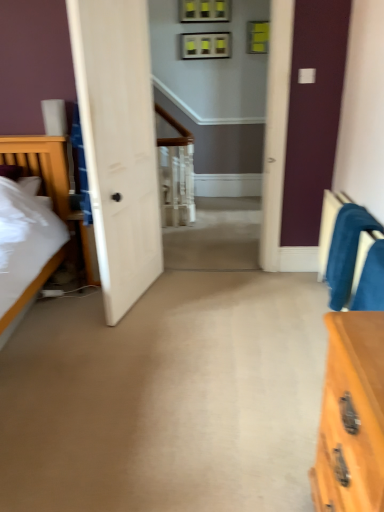
I want to click on vacant area on top of velvet blue armchair at right, the second armchair in the front-to-back sequence (from a real-world perspective), so click(x=358, y=212).